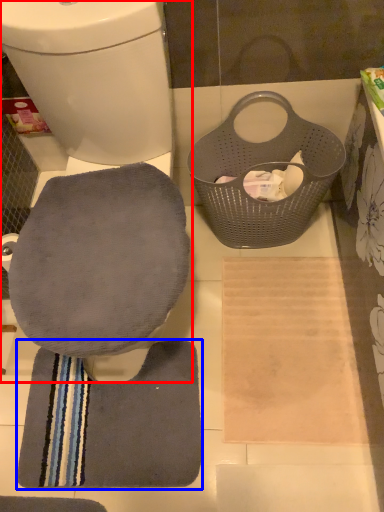
Question: Among these objects, which one is farthest to the camera, toilet (highlighted by a red box) or bath towel (highlighted by a blue box)?

Choices:
 (A) toilet
 (B) bath towel

Answer: (B)